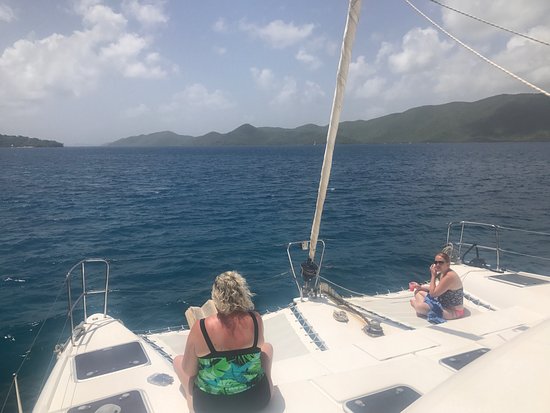
At what (x,y) coordinates should I click in order to perform the action: click on glass. Please return your answer as a coordinate pair (x, y). Looking at the image, I should click on (411, 288).